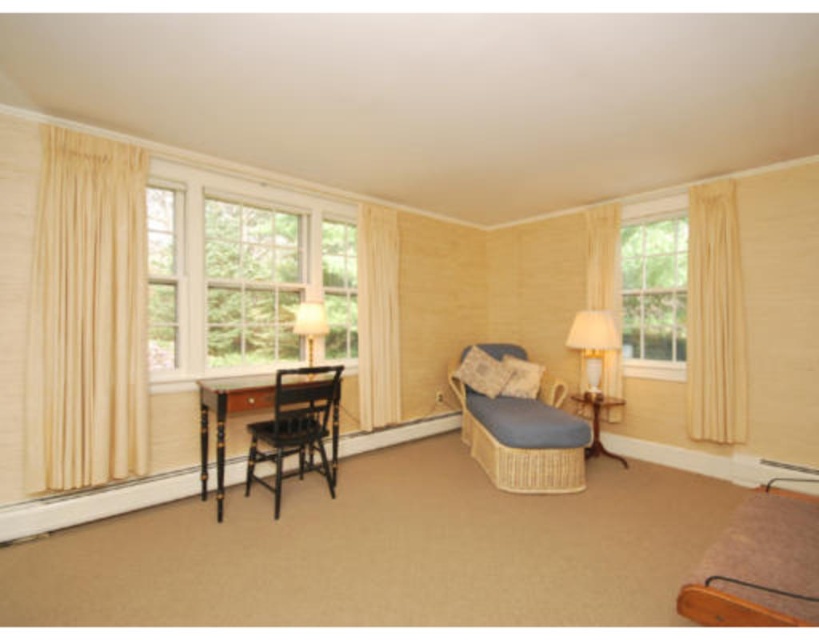
Question: Which point is farther to the camera?

Choices:
 (A) white glossy table lamp at right
 (B) patterned fabric pillow at center

Answer: (B)

Question: Is clear glass window at upper right to the right of sheer yellow curtain at right from the viewer's perspective?

Choices:
 (A) no
 (B) yes

Answer: (B)

Question: Which object is farther from the camera taking this photo?

Choices:
 (A) sheer yellow curtain at right
 (B) beige linen curtain at left
 (C) clear glass window at upper left
 (D) woven fabric pillow at center

Answer: (A)

Question: Does woven fabric pillow at center have a greater width compared to patterned fabric pillow at center?

Choices:
 (A) no
 (B) yes

Answer: (B)

Question: Which of the following is the closest to the observer?

Choices:
 (A) (492, 454)
 (B) (695, 310)
 (C) (627, 355)
 (D) (333, 419)

Answer: (D)

Question: Is black wood table at lower left closer to camera compared to white glossy table lamp at right?

Choices:
 (A) yes
 (B) no

Answer: (A)